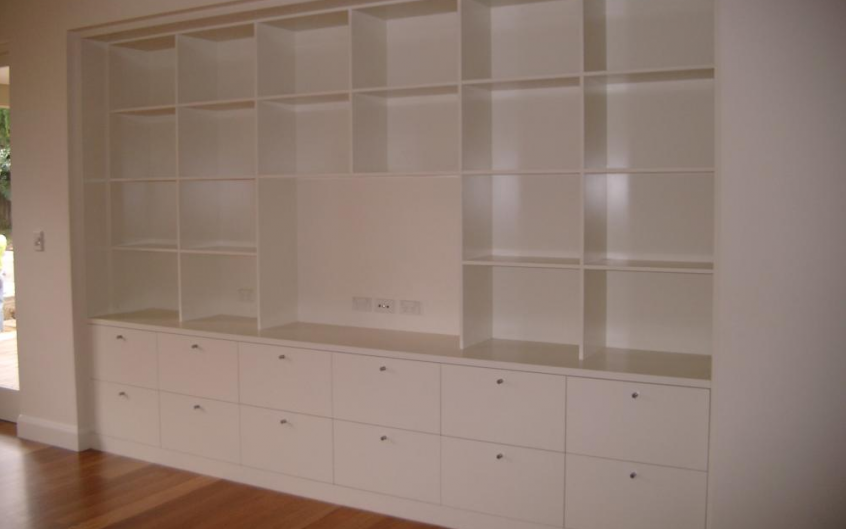
Image resolution: width=846 pixels, height=529 pixels. I want to click on open space for tv, so 380,256.